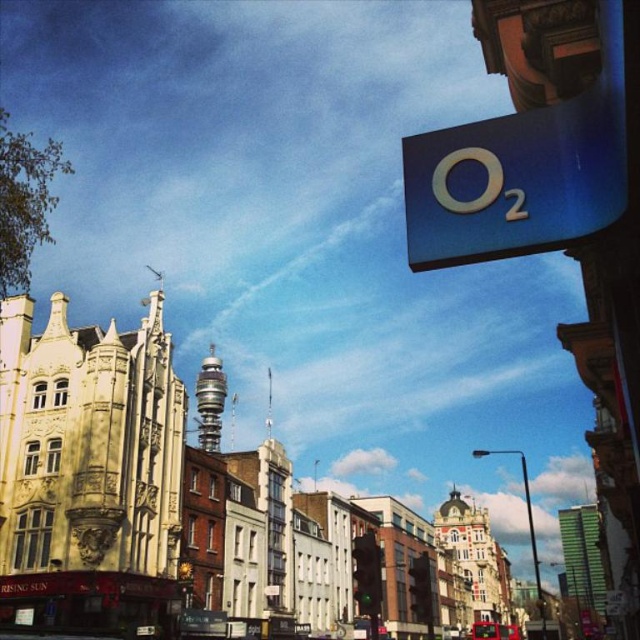
Can you confirm if blue glossy sign at upper right is wider than metallic red bus at lower center?

No.

Can you confirm if blue glossy sign at upper right is positioned to the right of metallic red bus at lower center?

Incorrect, blue glossy sign at upper right is not on the right side of metallic red bus at lower center.

Where is `blue glossy sign at upper right`? This screenshot has height=640, width=640. blue glossy sign at upper right is located at coordinates (528, 168).